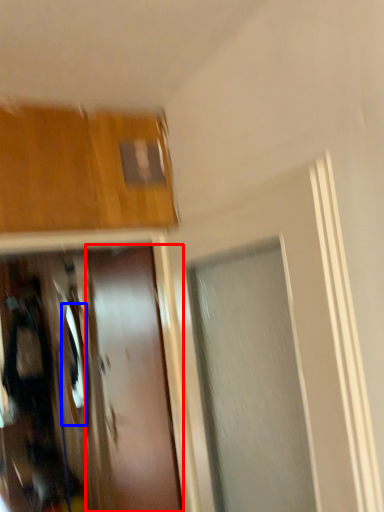
Question: Which of the following is the farthest to the observer, door (highlighted by a red box) or mirror (highlighted by a blue box)?

Choices:
 (A) door
 (B) mirror

Answer: (B)